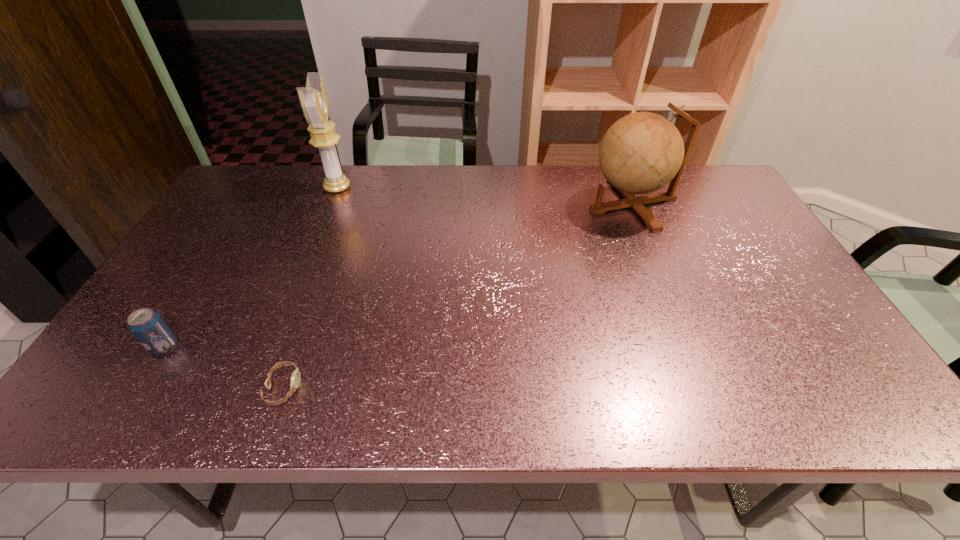
Locate an element on the screen. award is located at coordinates (313, 98).

The height and width of the screenshot is (540, 960). What are the coordinates of `globe` in the screenshot? It's located at pyautogui.click(x=641, y=153).

You are a GUI agent. You are given a task and a screenshot of the screen. Output one action in this format:
    pyautogui.click(x=<x>, y=<y>)
    Task: Click on the leftmost object
    The height and width of the screenshot is (540, 960).
    Given the screenshot: What is the action you would take?
    pyautogui.click(x=150, y=329)

I want to click on pop soda, so click(x=150, y=329).

The height and width of the screenshot is (540, 960). I want to click on the nearest object, so click(296, 375).

At what (x,y) coordinates should I click in order to perform the action: click on watch. Please return your answer as a coordinate pair (x, y). The image size is (960, 540). Looking at the image, I should click on (296, 375).

Locate an element on the screen. vacant space located on the front-facing side of the award is located at coordinates [381, 188].

At what (x,y) coordinates should I click in order to perform the action: click on vacant space located on the surface of the globe. Please return your answer as a coordinate pair (x, y). Image resolution: width=960 pixels, height=540 pixels. Looking at the image, I should click on (565, 205).

Where is `free space located 0.130m on the surface of the globe`? The image size is (960, 540). free space located 0.130m on the surface of the globe is located at coordinates (546, 205).

Where is `blank area located 0.340m on the surface of the globe`? blank area located 0.340m on the surface of the globe is located at coordinates (479, 205).